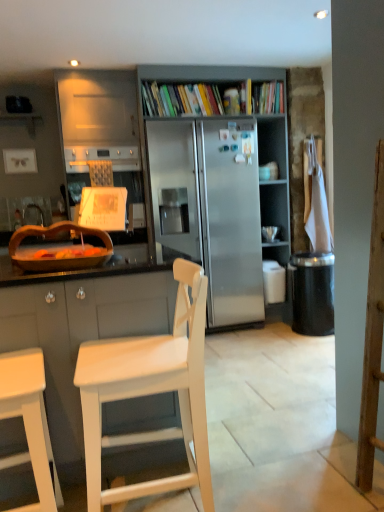
Question: In terms of width, does white cloth at right look wider or thinner when compared to matte blue coffee cup at upper right?

Choices:
 (A) thin
 (B) wide

Answer: (A)

Question: Considering the positions of white cloth at right and matte blue coffee cup at upper right in the image, is white cloth at right bigger or smaller than matte blue coffee cup at upper right?

Choices:
 (A) small
 (B) big

Answer: (B)

Question: Which is farther from the white cloth at right?

Choices:
 (A) white wood chair at center, the 2th chair positioned from the left
 (B) stainless steel refrigerator at center
 (C) brushed metal faucet at left
 (D) white matte chair at lower left, arranged as the 2th chair when viewed from the right
 (E) matte blue coffee cup at upper right

Answer: (D)

Question: Based on their relative distances, which object is farther from the matte blue coffee cup at upper right?

Choices:
 (A) stainless steel refrigerator at center
 (B) white matte chair at lower left, positioned as the first chair in left-to-right order
 (C) wooden bowl at left
 (D) black plastic trash can at lower right
 (E) white cloth at right

Answer: (B)